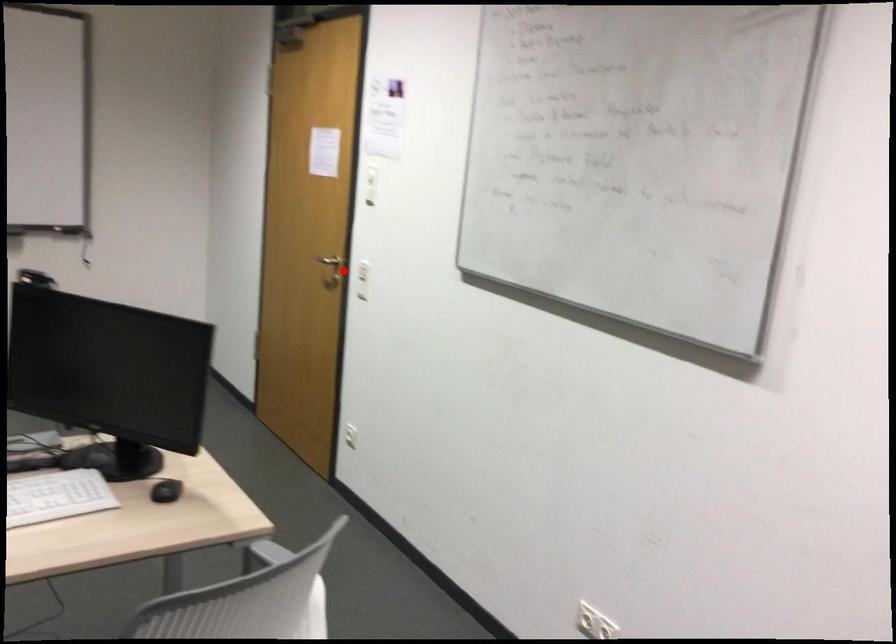
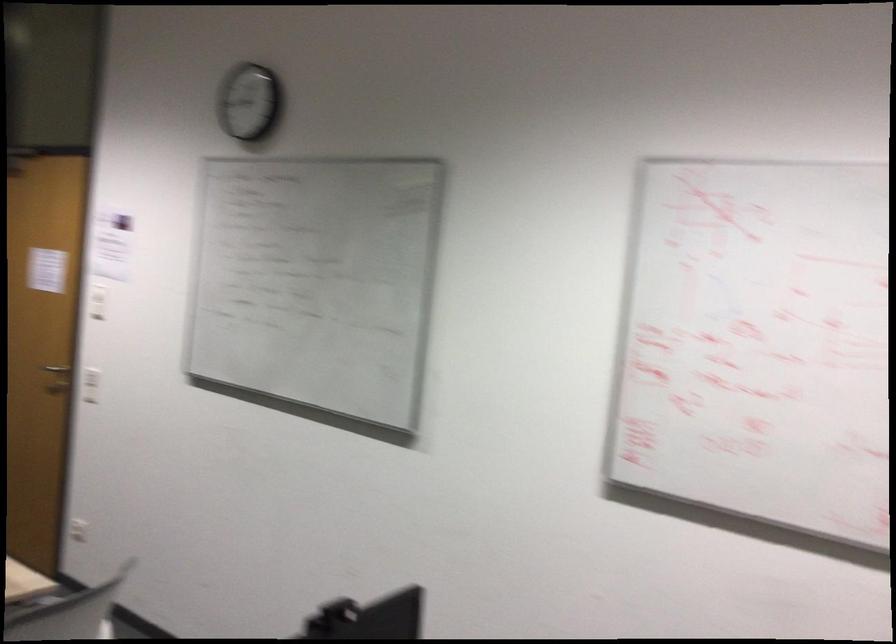
Question: A red point is marked in image1. In image2, is the corresponding 3D point closer to the camera or farther? Reply with the corresponding letter.

Choices:
 (A) The corresponding 3D point is closer.
 (B) The corresponding 3D point is farther.

Answer: (B)